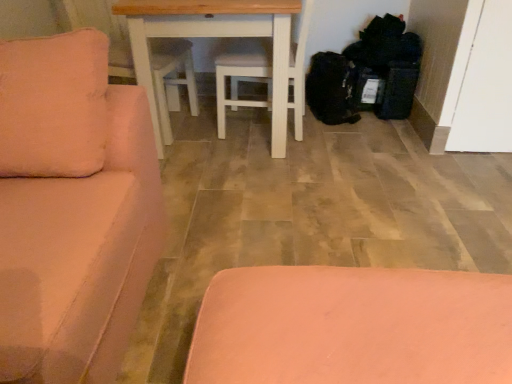
Question: Considering the positions of velvet pink couch at left and pink matte ottoman at lower center in the image, is velvet pink couch at left bigger or smaller than pink matte ottoman at lower center?

Choices:
 (A) small
 (B) big

Answer: (B)

Question: From the image's perspective, is velvet pink couch at left positioned above or below pink matte ottoman at lower center?

Choices:
 (A) below
 (B) above

Answer: (B)

Question: Which is farther from the velvet pink couch at left?

Choices:
 (A) white painted wood table at center
 (B) black fabric bags at lower right
 (C) pink matte ottoman at lower center

Answer: (B)

Question: Based on their relative distances, which object is nearer to the pink matte ottoman at lower center?

Choices:
 (A) velvet pink couch at left
 (B) white painted wood table at center
 (C) black fabric bags at lower right

Answer: (A)